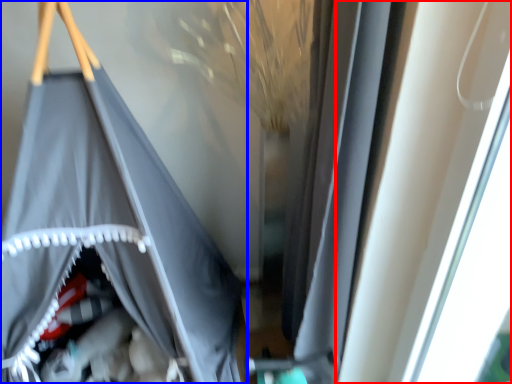
Question: Among these objects, which one is farthest to the camera, window (highlighted by a red box) or curtain (highlighted by a blue box)?

Choices:
 (A) window
 (B) curtain

Answer: (B)